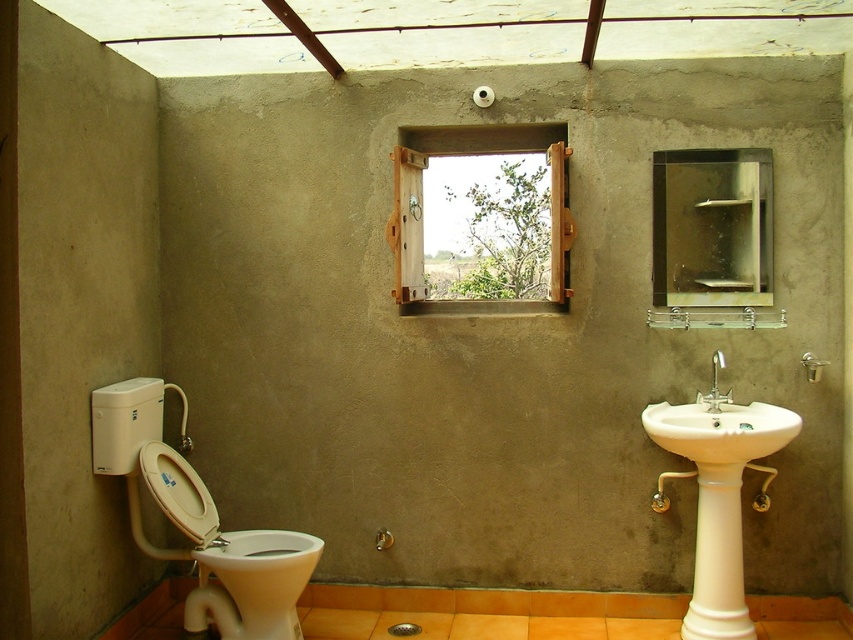
Describe the element at coordinates (712, 227) in the screenshot. I see `clear glass mirror at upper center` at that location.

Where is `clear glass mirror at upper center`? clear glass mirror at upper center is located at coordinates (712, 227).

Is wooden frame at center above clear glass mirror at upper center?

Yes, wooden frame at center is above clear glass mirror at upper center.

Is wooden frame at center to the right of clear glass mirror at upper center from the viewer's perspective?

In fact, wooden frame at center is to the left of clear glass mirror at upper center.

Is point (514, 184) positioned before point (747, 227)?

No, it is behind (747, 227).

Where is `wooden frame at center`? The height and width of the screenshot is (640, 853). wooden frame at center is located at coordinates (x=480, y=218).

Is white ceramic sink at right shorter than silver metallic faucet at sink right?

In fact, white ceramic sink at right may be taller than silver metallic faucet at sink right.

The height and width of the screenshot is (640, 853). What do you see at coordinates (718, 433) in the screenshot?
I see `white ceramic sink at right` at bounding box center [718, 433].

Describe the element at coordinates (718, 433) in the screenshot. I see `white ceramic sink at right` at that location.

This screenshot has height=640, width=853. Identify the location of white ceramic sink at right. tap(718, 433).